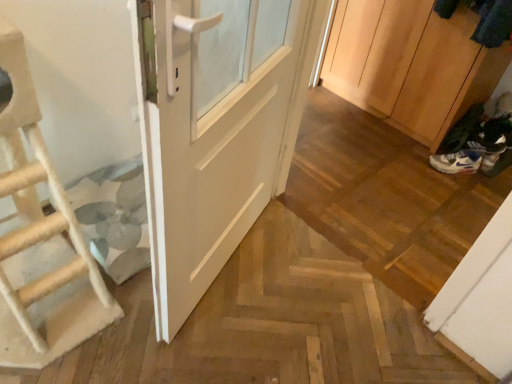
At what (x,y) coordinates should I click in order to perform the action: click on free space to the left of white mesh shoe at lower right. Please return your answer as a coordinate pair (x, y). Looking at the image, I should click on (417, 160).